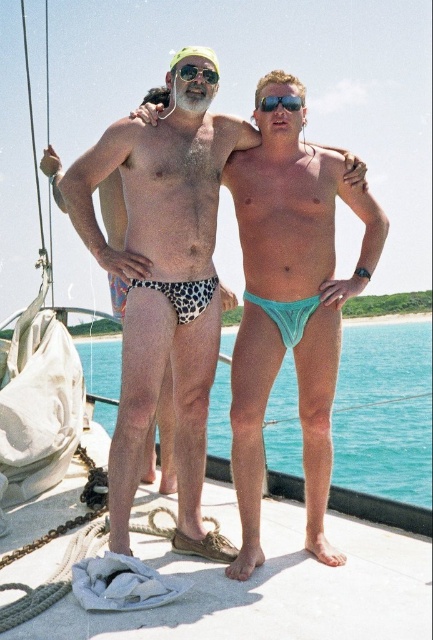
Question: Which point is farther to the camera?

Choices:
 (A) green plastic goggles at upper center
 (B) sunglasses at center
 (C) leopard print swim trunks at center
 (D) teal fabric thong at center

Answer: (B)

Question: Among these points, which one is nearest to the camera?

Choices:
 (A) (328, 484)
 (B) (177, 74)
 (C) (272, 109)
 (D) (74, 218)

Answer: (A)

Question: Does sunglasses at center appear under green plastic goggles at upper center?

Choices:
 (A) yes
 (B) no

Answer: (A)

Question: Considering the real-world distances, which object is closest to the teal fabric thong at center?

Choices:
 (A) leopard print swim trunks at center
 (B) sunglasses at center
 (C) green plastic goggles at upper center

Answer: (A)

Question: Does leopard print swim trunks at center have a lesser width compared to sunglasses at center?

Choices:
 (A) yes
 (B) no

Answer: (B)

Question: Does teal fabric thong at center appear on the right side of sunglasses at center?

Choices:
 (A) yes
 (B) no

Answer: (A)